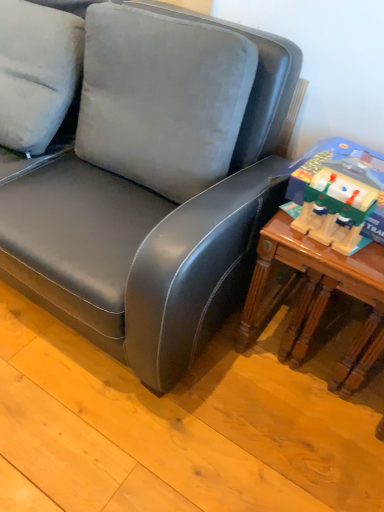
Question: Based on their sizes in the image, would you say wooden train set at right is bigger or smaller than wooden table at right?

Choices:
 (A) big
 (B) small

Answer: (B)

Question: Considering the relative positions of wooden train set at right and wooden table at right in the image provided, is wooden train set at right to the left or to the right of wooden table at right?

Choices:
 (A) left
 (B) right

Answer: (A)

Question: From a real-world perspective, is wooden train set at right above or below wooden table at right?

Choices:
 (A) below
 (B) above

Answer: (B)

Question: In the image, is wooden table at right positioned in front of or behind wooden train set at right?

Choices:
 (A) behind
 (B) front

Answer: (A)

Question: Would you say wooden table at right is inside or outside wooden train set at right?

Choices:
 (A) inside
 (B) outside

Answer: (B)

Question: From the image's perspective, is wooden table at right positioned above or below wooden train set at right?

Choices:
 (A) above
 (B) below

Answer: (B)

Question: Considering the positions of point (367, 245) and point (369, 180), is point (367, 245) closer or farther from the camera than point (369, 180)?

Choices:
 (A) farther
 (B) closer

Answer: (A)